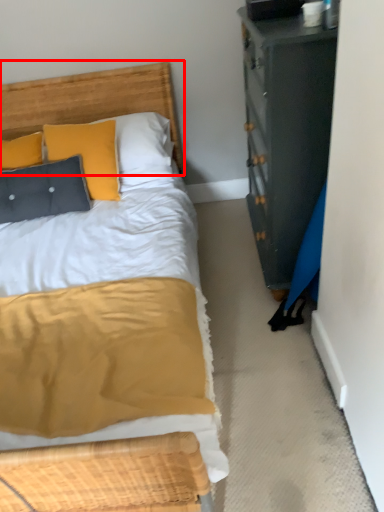
Question: From the image's perspective, what is the correct spatial relationship of headboard (annotated by the red box) in relation to pillow?

Choices:
 (A) below
 (B) above

Answer: (B)